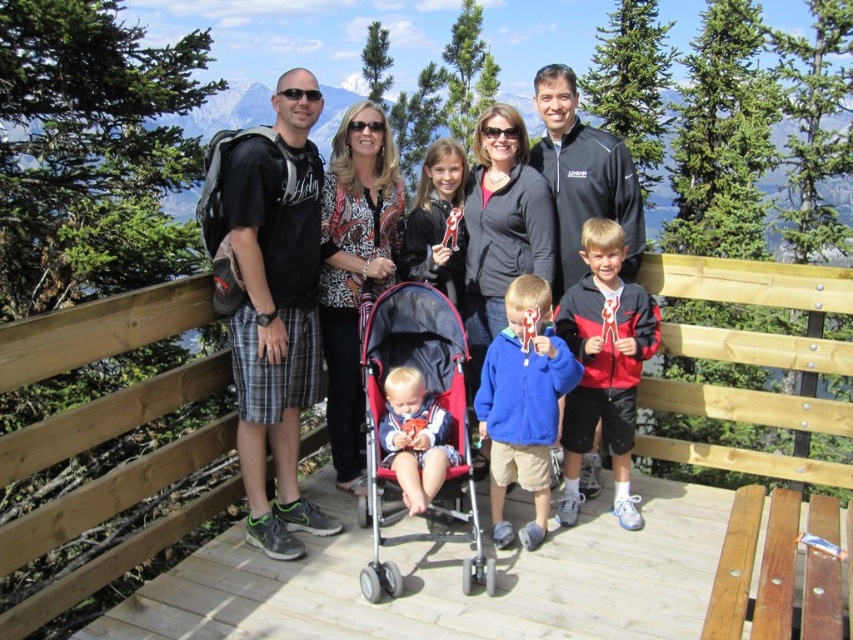
Based on the photo, you are a photographer trying to position the blue fleece jacket at center and the wooden bench at lower center in a way that they appear balanced in the frame. Considering their sizes, which object should you place closer to the camera to achieve this balance?

Answer: Since the wooden bench at lower center is smaller in size compared to the blue fleece jacket at center, you should place the wooden bench at lower center closer to the camera to make it visually larger and balance it with the blue fleece jacket at center.

Based on the photo, you are a photographer trying to arrange the family members for a group photo. The wooden bench at lower center and the blue fleece jacket at center are both in the scene. If you want to seat the tallest child on the widest available furniture, which object should you choose?

The wooden bench at lower center has a larger width than the blue fleece jacket at center, so you should choose the wooden bench at lower center to seat the tallest child.